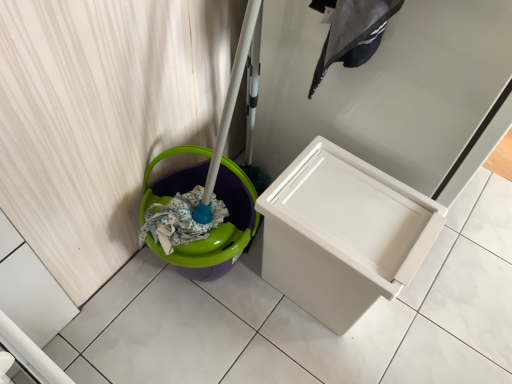
The image size is (512, 384). I want to click on free location to the left of white plastic waste container at center, so click(226, 327).